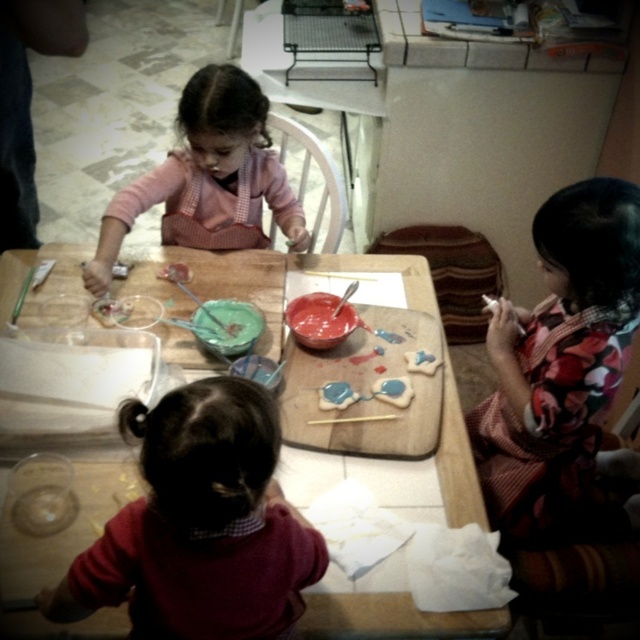
You are a parent observing the baking activity. You notice a point marked at coordinates (208,179) on the image. What object is located at that point?

The point at coordinates (208,179) marks the pink fabric dress at upper left.

You are a parent standing at the kitchen counter in the background. You need to hand a cookie to the child wearing the pink fabric dress at upper left. The cookie is on the table. Can you reach it without moving from your current position?

The distance between the kitchen counter in the background and the pink fabric dress at upper left is 1.47 meters. Since the parent is at the kitchen counter, they would need to stretch or move closer to reach the cookie on the table, which is 1.47 meters away. It might be challenging to reach without moving.

You are a parent observing the baking activity. You need to determine which item takes up more space on the table between the pink fabric dress at upper left and the blue matte cookie at center. Which one is larger?

The pink fabric dress at upper left is bigger than the blue matte cookie at center, so the pink fabric dress at upper left takes up more space on the table.